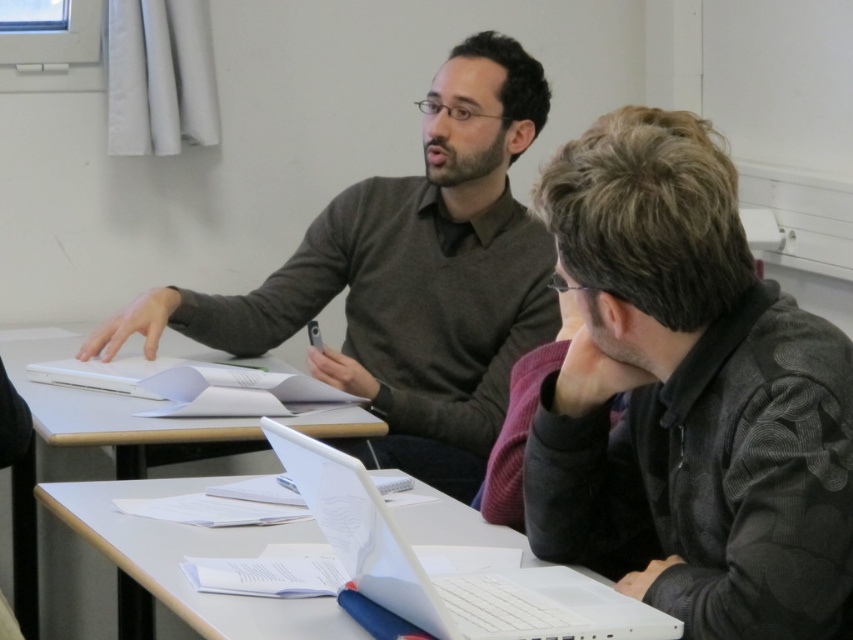
Who is shorter, dark gray textured jacket at center or white plastic laptop at lower center?

white plastic laptop at lower center

Does point (624, 241) lie behind point (367, 516)?

Yes, point (624, 241) is behind point (367, 516).

Locate an element on the screen. This screenshot has width=853, height=640. dark gray textured jacket at center is located at coordinates (688, 397).

Is dark gray sweater at center behind white plastic laptop at lower center?

Yes, it is.

Between point (231, 326) and point (401, 605), which one is positioned in front?

Point (401, 605) is more forward.

This screenshot has height=640, width=853. In order to click on dark gray sweater at center in this screenshot , I will do `click(410, 276)`.

Is dark gray sweater at center taller than white plastic table at center?

Yes.

Does dark gray sweater at center have a greater width compared to white plastic table at center?

Yes, dark gray sweater at center is wider than white plastic table at center.

Image resolution: width=853 pixels, height=640 pixels. I want to click on dark gray sweater at center, so click(x=410, y=276).